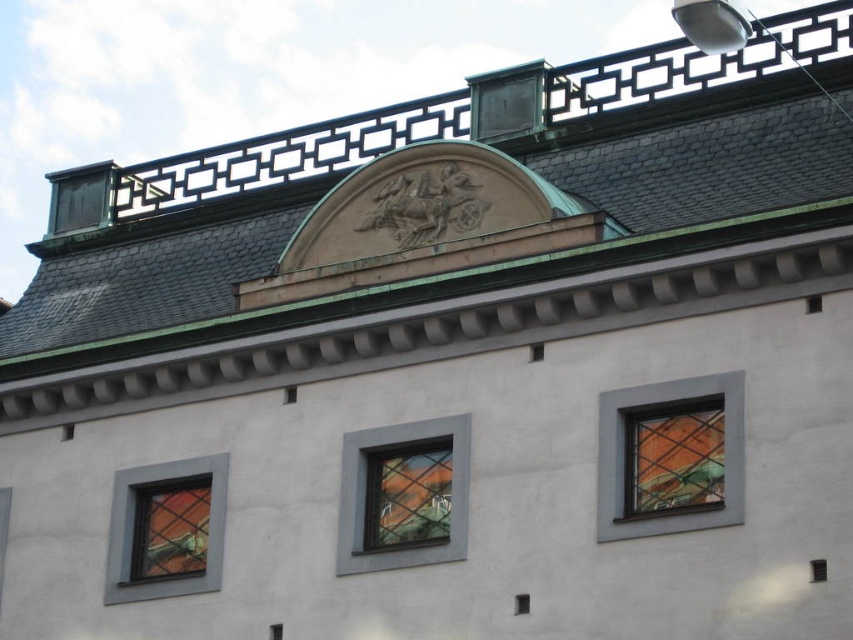
In the scene shown: Can you confirm if clear glass window at right is positioned to the left of clear glass window at center?

Incorrect, clear glass window at right is not on the left side of clear glass window at center.

The image size is (853, 640). I want to click on clear glass window at right, so click(672, 456).

Which of these two, clear glass window at right or transparent glass window at center, stands shorter?

Standing shorter between the two is clear glass window at right.

Locate an element on the screen. clear glass window at right is located at coordinates (672, 456).

Based on the photo, can you confirm if transparent glass window at center is shorter than matte glass window at lower left?

No, transparent glass window at center is not shorter than matte glass window at lower left.

Where is `transparent glass window at center`? Image resolution: width=853 pixels, height=640 pixels. transparent glass window at center is located at coordinates (407, 496).

Where is `transparent glass window at center`? Image resolution: width=853 pixels, height=640 pixels. transparent glass window at center is located at coordinates (407, 496).